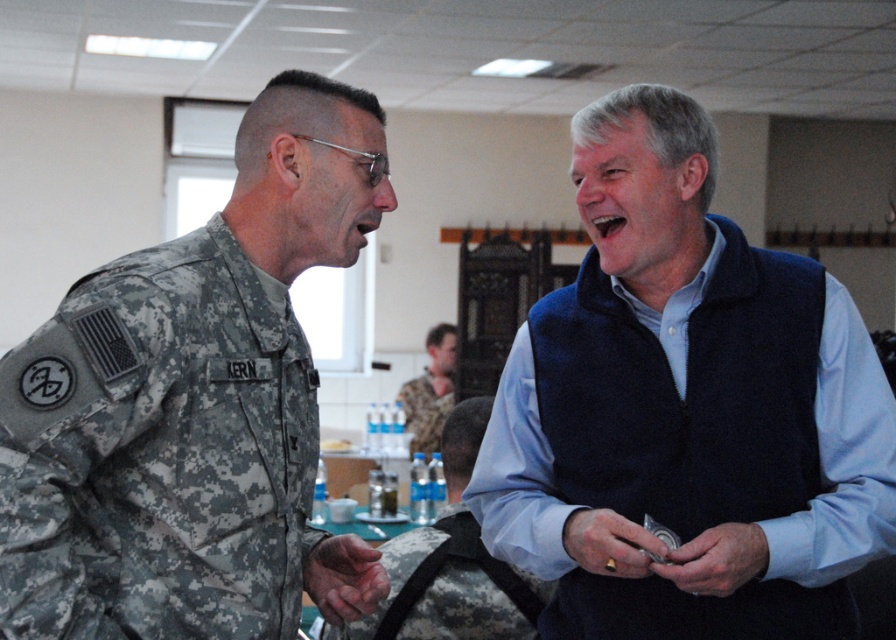
Can you confirm if metallic silver watch at lower center is positioned to the left of dry skin at center?

Incorrect, metallic silver watch at lower center is not on the left side of dry skin at center.

Is metallic silver watch at lower center below dry skin at center?

Incorrect, metallic silver watch at lower center is not positioned below dry skin at center.

Which is in front, point (730, 570) or point (376, 563)?

Positioned in front is point (730, 570).

The width and height of the screenshot is (896, 640). I want to click on metallic silver watch at lower center, so click(x=716, y=560).

Based on the photo, who is positioned more to the right, camouflage uniform at left or metallic ring at lower center?

Positioned to the right is metallic ring at lower center.

In the scene shown: Can you confirm if camouflage uniform at left is smaller than metallic ring at lower center?

Incorrect, camouflage uniform at left is not smaller in size than metallic ring at lower center.

Is point (71, 400) less distant than point (636, 566)?

Yes, it is.

I want to click on camouflage uniform at left, so click(187, 400).

Does point (343, 550) lie behind point (604, 547)?

Yes.

Which is below, dry skin at center or metallic ring at lower center?

dry skin at center is below.

Is point (319, 557) farther from viewer compared to point (599, 532)?

That is True.

Locate an element on the screen. The image size is (896, 640). dry skin at center is located at coordinates (343, 577).